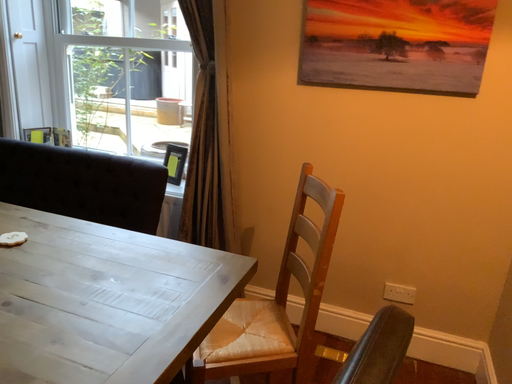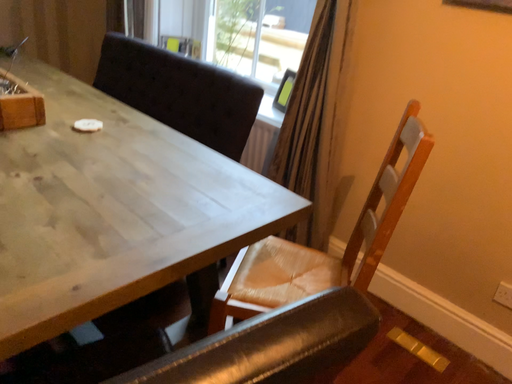
Question: Which way did the camera rotate in the video?

Choices:
 (A) rotated left
 (B) rotated right

Answer: (A)